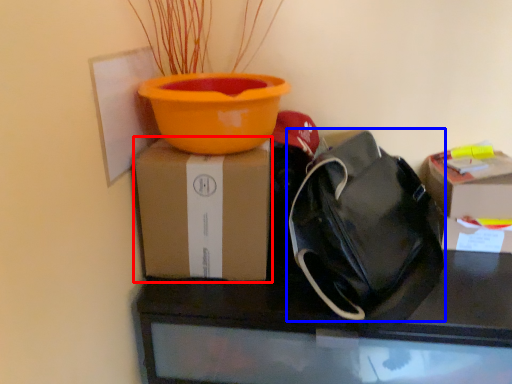
Question: Which object appears closest to the camera in this image, box (highlighted by a red box) or handbag (highlighted by a blue box)?

Choices:
 (A) box
 (B) handbag

Answer: (B)